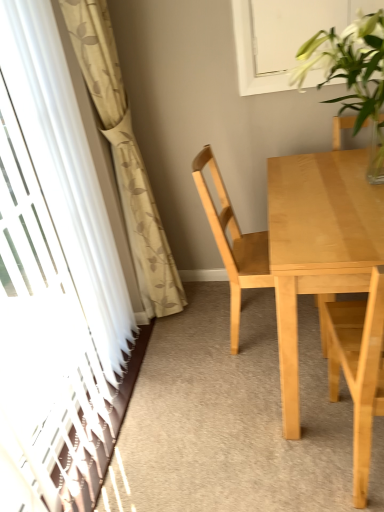
This screenshot has width=384, height=512. What are the coordinates of `vacant space to the left of light wood chair at right, arranged as the first chair when viewed from the front` in the screenshot? It's located at (271, 456).